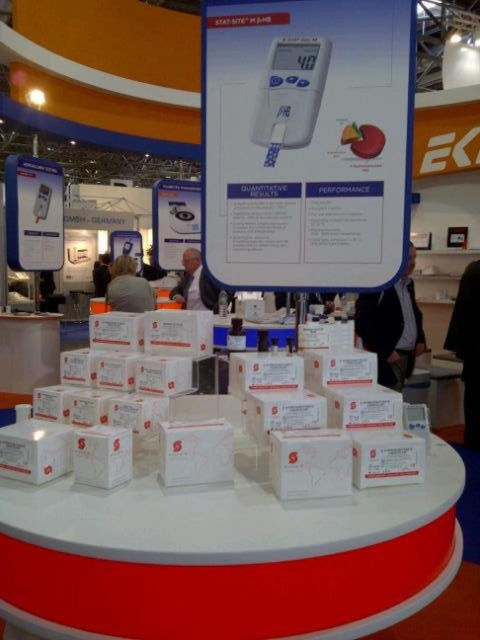
Where is `black fabric jacket at right`? This screenshot has height=640, width=480. black fabric jacket at right is located at coordinates (392, 326).

Can you confirm if black fabric jacket at right is positioned below black fabric chair at right?

No, black fabric jacket at right is not below black fabric chair at right.

Where is `black fabric jacket at right`? black fabric jacket at right is located at coordinates (392, 326).

Measure the distance from black fabric chair at right to gray fabric jacket at center.

A distance of 3.24 meters exists between black fabric chair at right and gray fabric jacket at center.

Between point (464, 346) and point (133, 273), which one is positioned behind?

Point (133, 273)

Does point (471, 353) come farther from viewer compared to point (139, 308)?

No, (471, 353) is in front of (139, 308).

Where is `black fabric chair at right`? Image resolution: width=480 pixels, height=640 pixels. black fabric chair at right is located at coordinates (468, 348).

Can you confirm if black fabric jacket at right is positioned above gray fabric jacket at center?

No, black fabric jacket at right is not above gray fabric jacket at center.

Can you confirm if black fabric jacket at right is positioned to the right of gray fabric jacket at center?

Indeed, black fabric jacket at right is positioned on the right side of gray fabric jacket at center.

Is point (363, 305) more distant than point (120, 298)?

No, (363, 305) is in front of (120, 298).

The image size is (480, 640). I want to click on black fabric jacket at right, so pyautogui.click(x=392, y=326).